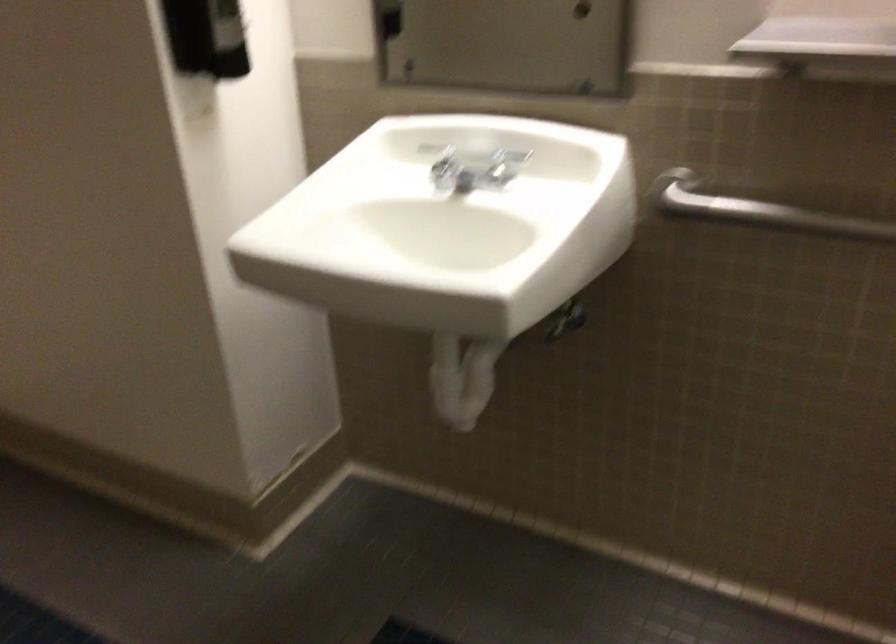
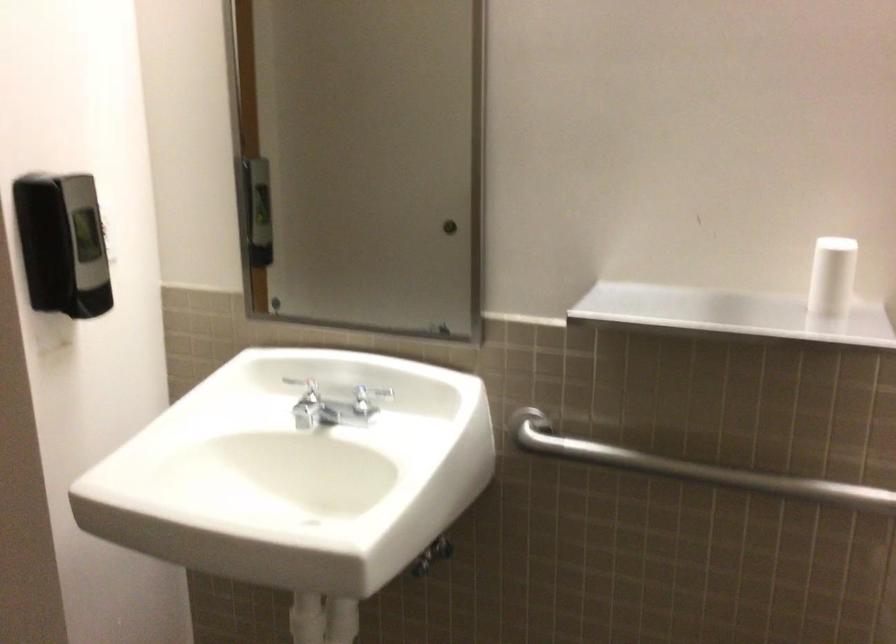
Find the pixel in the second image that matches the point at 461,382 in the first image.

(325, 623)